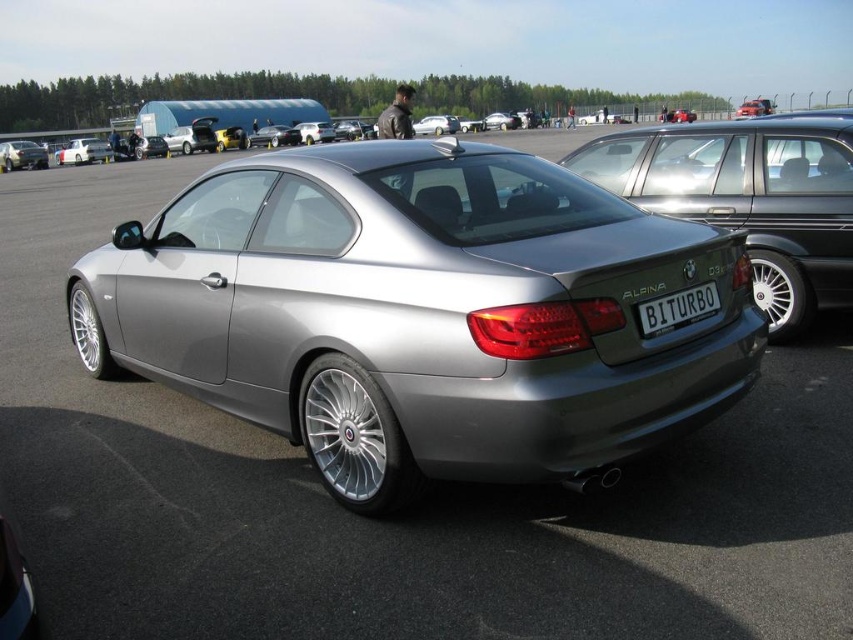
Between satin silver metallic car at center and matte silver car at left, which one appears on the left side from the viewer's perspective?

Positioned to the left is matte silver car at left.

Does satin silver metallic car at center have a lesser height compared to matte silver car at left?

Yes, satin silver metallic car at center is shorter than matte silver car at left.

Where is `satin silver metallic car at center`? The height and width of the screenshot is (640, 853). satin silver metallic car at center is located at coordinates (749, 196).

Which is behind, point (668, 317) or point (25, 161)?

Positioned behind is point (25, 161).

This screenshot has width=853, height=640. What do you see at coordinates (677, 307) in the screenshot? I see `white plastic license plate at rear` at bounding box center [677, 307].

Does point (637, 305) come in front of point (7, 150)?

Yes, point (637, 305) is closer to viewer.

Find the location of a particular element. white plastic license plate at rear is located at coordinates (677, 307).

Can you confirm if satin silver metallic car at center is positioned below silver metallic sedan at center?

Indeed, satin silver metallic car at center is positioned under silver metallic sedan at center.

Between satin silver metallic car at center and silver metallic sedan at center, which one appears on the left side from the viewer's perspective?

silver metallic sedan at center is more to the left.

Which is in front, point (776, 301) or point (107, 145)?

Point (776, 301) is more forward.

You are a GUI agent. You are given a task and a screenshot of the screen. Output one action in this format:
    pyautogui.click(x=<x>, y=<y>)
    Task: Click on the satin silver metallic car at center
    The height and width of the screenshot is (640, 853).
    Given the screenshot: What is the action you would take?
    pyautogui.click(x=749, y=196)